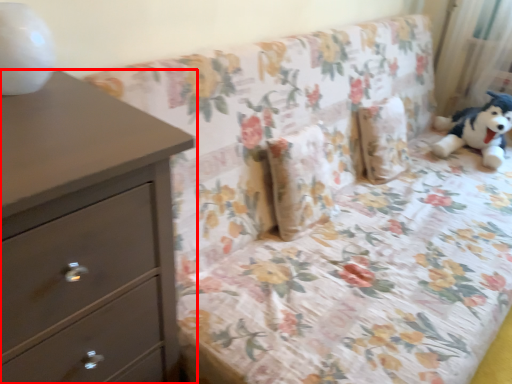
Question: From the image's perspective, considering the relative positions of chest of drawers (annotated by the red box) and curtain in the image provided, where is chest of drawers (annotated by the red box) located with respect to the staircase?

Choices:
 (A) above
 (B) below

Answer: (B)